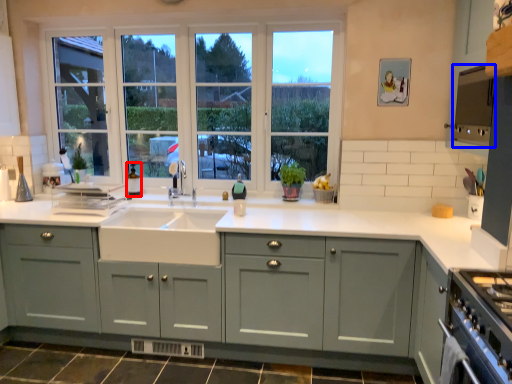
Question: Among these objects, which one is farthest to the camera, bottle (highlighted by a red box) or appliance (highlighted by a blue box)?

Choices:
 (A) bottle
 (B) appliance

Answer: (A)